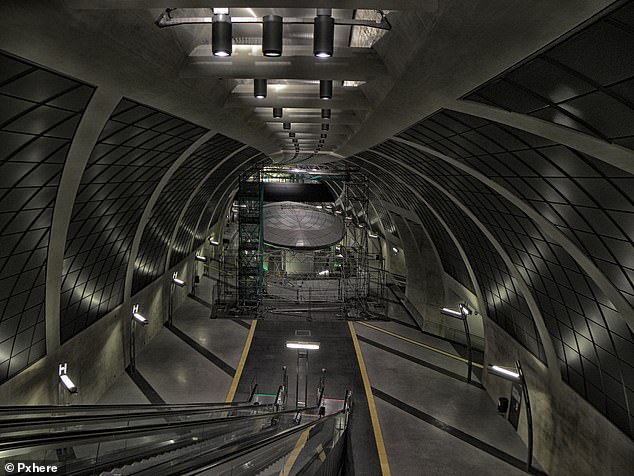
Identify the location of ceiling supports. (54, 268), (134, 248), (172, 242), (207, 226), (196, 230), (609, 148), (510, 198), (477, 221), (453, 234), (428, 237).